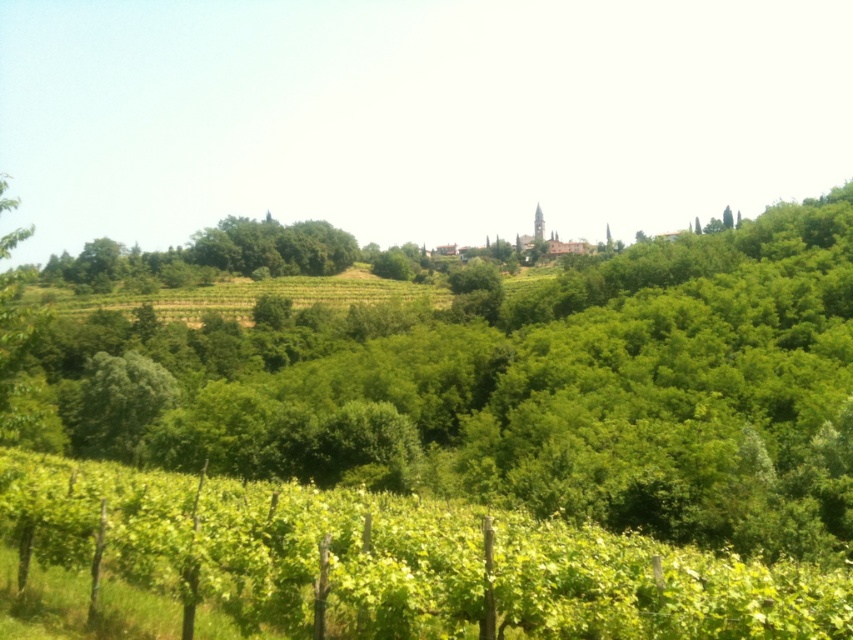
From the picture: Who is taller, green leafy tree at center or green leafy vineyard at lower center?

green leafy tree at center

Is green leafy tree at center positioned in front of green leafy vineyard at lower center?

No, it is not.

The width and height of the screenshot is (853, 640). I want to click on green leafy tree at center, so click(514, 388).

Image resolution: width=853 pixels, height=640 pixels. In order to click on green leafy tree at center in this screenshot , I will do `click(514, 388)`.